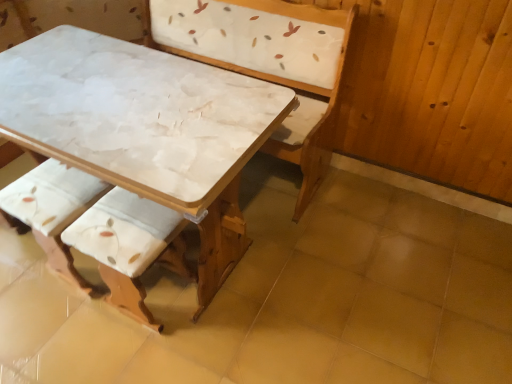
Question: Would you say white fabric cushion at lower left, the 2th armchair positioned from the left, is inside or outside white fabric cushion at lower left, arranged as the 1th armchair when viewed from the left?

Choices:
 (A) outside
 (B) inside

Answer: (A)

Question: Based on their positions, is white fabric cushion at lower left, the 2th armchair positioned from the left, located to the left or right of white fabric cushion at lower left, which is the 2th armchair from right to left?

Choices:
 (A) right
 (B) left

Answer: (A)

Question: Estimate the real-world distances between objects in this image. Which object is closer to the white marble table at center?

Choices:
 (A) white fabric cushion at lower left, arranged as the 1th armchair when viewed from the left
 (B) white fabric cushion at lower left, the 1th armchair from the right
 (C) white marble table at center

Answer: (A)

Question: Estimate the real-world distances between objects in this image. Which object is farther from the white marble table at center?

Choices:
 (A) white fabric cushion at lower left, the 1th armchair from the right
 (B) white marble table at center
 (C) white fabric cushion at lower left, which is the 2th armchair from right to left

Answer: (B)